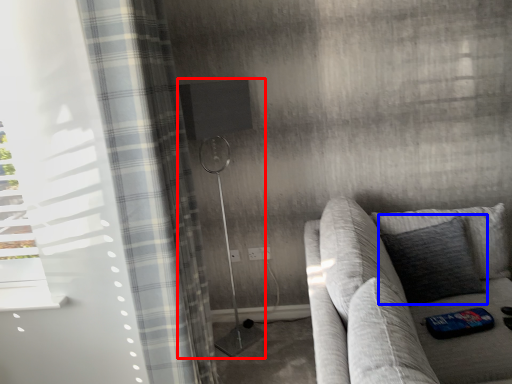
Question: Which of the following is the farthest to the observer, shower (highlighted by a red box) or pillow (highlighted by a blue box)?

Choices:
 (A) shower
 (B) pillow

Answer: (A)